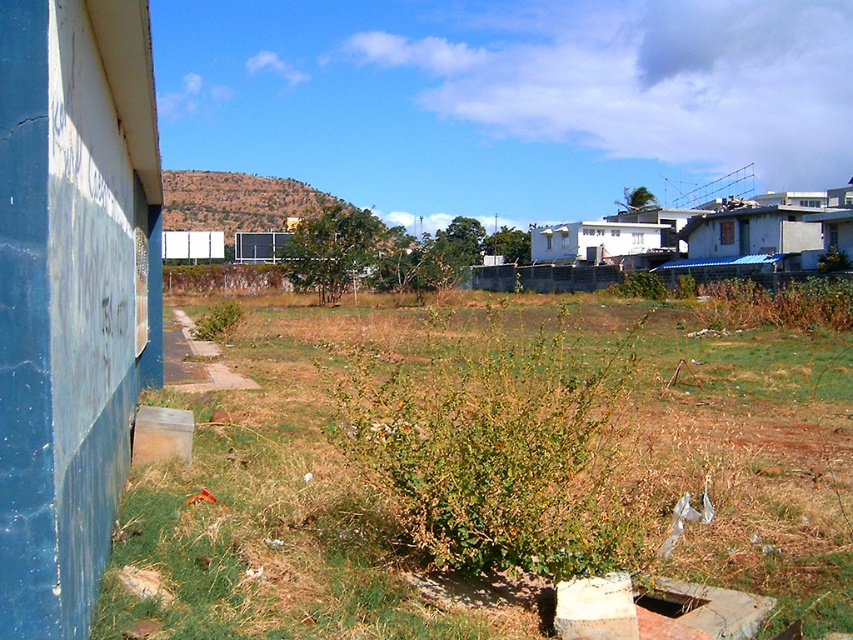
Question: Which of the following is the closest to the observer?

Choices:
 (A) (534, 493)
 (B) (694, 602)
 (C) (759, 513)

Answer: (A)

Question: Which object is farther from the camera taking this photo?

Choices:
 (A) green grass at lower left
 (B) green leafy bush at center
 (C) dark brown concrete hole at lower center

Answer: (C)

Question: Which object is the closest to the green leafy bush at center?

Choices:
 (A) dark brown concrete hole at lower center
 (B) green grass at lower left

Answer: (A)

Question: Considering the relative positions of green grass at lower left and dark brown concrete hole at lower center in the image provided, where is green grass at lower left located with respect to dark brown concrete hole at lower center?

Choices:
 (A) left
 (B) right

Answer: (B)

Question: Is green grass at lower left thinner than green leafy bush at center?

Choices:
 (A) no
 (B) yes

Answer: (A)

Question: Is green leafy bush at center bigger than dark brown concrete hole at lower center?

Choices:
 (A) no
 (B) yes

Answer: (B)